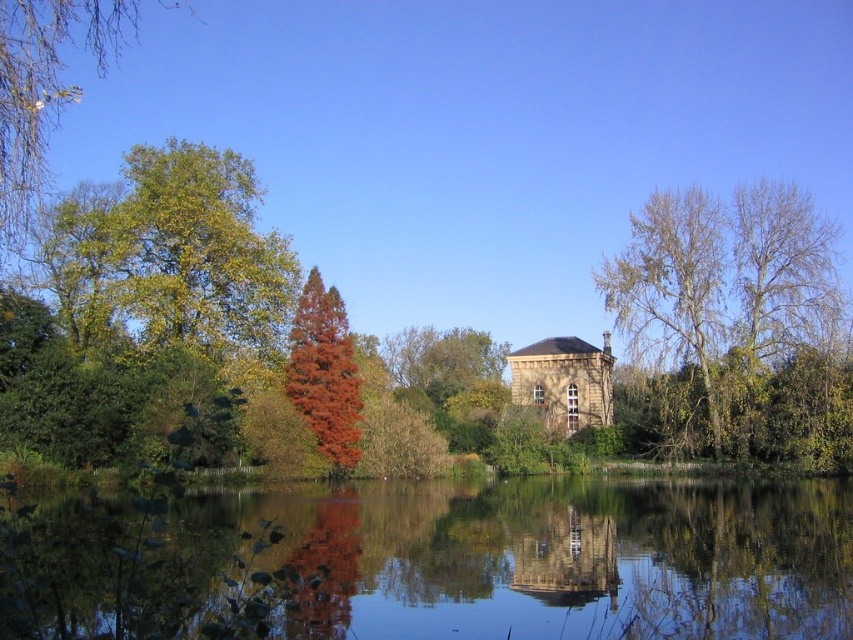
Who is higher up, bare branches at right or green leafy tree at upper left?

green leafy tree at upper left is higher up.

This screenshot has height=640, width=853. Find the location of `bare branches at right`. bare branches at right is located at coordinates (726, 292).

Measure the distance between bare branches at right and camera.

A distance of 165.95 feet exists between bare branches at right and camera.

This screenshot has height=640, width=853. Find the location of `bare branches at right`. bare branches at right is located at coordinates tap(726, 292).

Which is in front, point (117, 10) or point (312, 369)?

Point (312, 369) is in front.

Looking at this image, between green leafy tree at upper left and reddish-brown coniferous tree at center, which one has more height?

green leafy tree at upper left

Which is in front, point (10, 196) or point (340, 324)?

Point (10, 196)

I want to click on green leafy tree at upper left, so click(x=44, y=90).

Does transparent water at center have a smaller size compared to green leafy tree at upper left?

Yes.

Is point (41, 627) farther from camera compared to point (76, 35)?

That is False.

Between point (556, 541) and point (53, 24), which one is positioned in front?

Point (53, 24)

The width and height of the screenshot is (853, 640). What are the coordinates of `transparent water at center` in the screenshot? It's located at [438, 563].